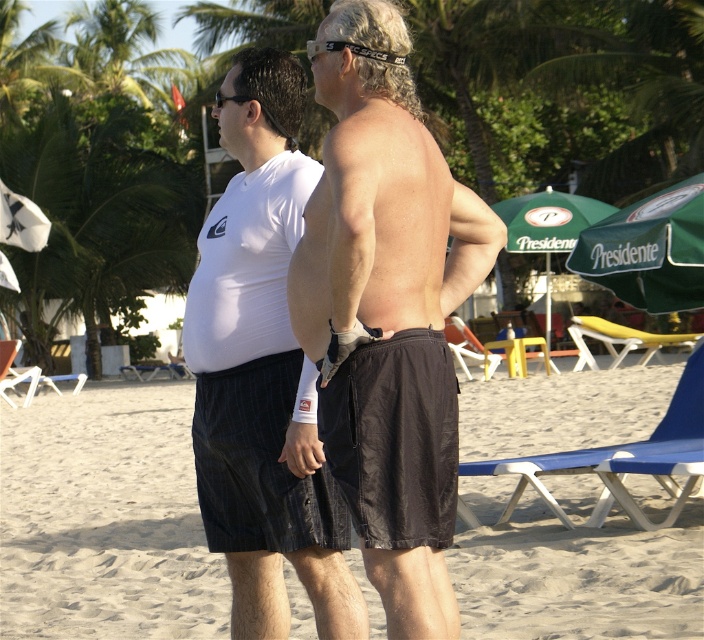
Question: Is black fabric shorts at center wider than white matte t-shirt at center?

Choices:
 (A) no
 (B) yes

Answer: (B)

Question: Is black fabric shorts at center to the right of white matte t-shirt at center from the viewer's perspective?

Choices:
 (A) no
 (B) yes

Answer: (B)

Question: Which of the following is the farthest from the observer?

Choices:
 (A) (363, 449)
 (B) (31, 470)

Answer: (B)

Question: Does black fabric shorts at center have a lesser width compared to white matte t-shirt at center?

Choices:
 (A) yes
 (B) no

Answer: (B)

Question: Which object is closer to the camera taking this photo?

Choices:
 (A) black fabric shorts at center
 (B) white matte t-shirt at center

Answer: (B)